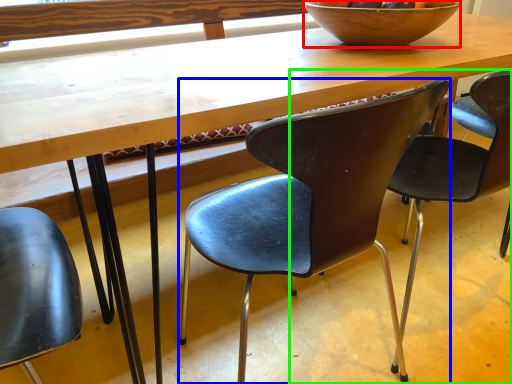
Question: Estimate the real-world distances between objects in this image. Which object is farther from bowl (highlighted by a red box), chair (highlighted by a blue box) or chair (highlighted by a green box)?

Choices:
 (A) chair
 (B) chair

Answer: (A)